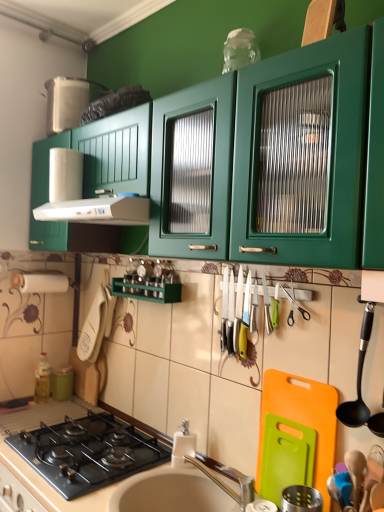
Question: Could you tell me if silver metallic faucet at sink center is turned towards white plastic exhaust hood at upper left?

Choices:
 (A) yes
 (B) no

Answer: (B)

Question: From the image's perspective, does silver metallic faucet at sink center appear lower than white plastic exhaust hood at upper left?

Choices:
 (A) yes
 (B) no

Answer: (A)

Question: From a real-world perspective, is silver metallic faucet at sink center positioned over white plastic exhaust hood at upper left based on gravity?

Choices:
 (A) yes
 (B) no

Answer: (B)

Question: Is silver metallic faucet at sink center in front of white plastic exhaust hood at upper left?

Choices:
 (A) yes
 (B) no

Answer: (A)

Question: Considering the relative sizes of silver metallic faucet at sink center and white plastic exhaust hood at upper left in the image provided, is silver metallic faucet at sink center smaller than white plastic exhaust hood at upper left?

Choices:
 (A) yes
 (B) no

Answer: (A)

Question: Is wooden spoon at lower right, marked as the 2th utensil in a top-to-bottom arrangement, in front of or behind blue rubber spatula at lower right, the 1th appliance when ordered from right to left, in the image?

Choices:
 (A) behind
 (B) front

Answer: (B)

Question: Would you say wooden spoon at lower right, marked as the 2th utensil in a top-to-bottom arrangement, is inside or outside blue rubber spatula at lower right, marked as the third appliance in a back-to-front arrangement?

Choices:
 (A) outside
 (B) inside

Answer: (B)

Question: Is wooden spoon at lower right, the first utensil from the bottom, wider or thinner than blue rubber spatula at lower right, the 1th appliance when ordered from right to left?

Choices:
 (A) thin
 (B) wide

Answer: (B)

Question: Considering the relative positions of wooden spoon at lower right, the first utensil from the bottom, and blue rubber spatula at lower right, marked as the third appliance in a back-to-front arrangement, in the image provided, is wooden spoon at lower right, the first utensil from the bottom, to the left or to the right of blue rubber spatula at lower right, marked as the third appliance in a back-to-front arrangement,?

Choices:
 (A) right
 (B) left

Answer: (B)

Question: From a real-world perspective, is white glossy sink at lower center physically located above or below green plastic cutting board at lower right, the 2th appliance positioned from the back?

Choices:
 (A) below
 (B) above

Answer: (A)

Question: In terms of width, does white glossy sink at lower center look wider or thinner when compared to green plastic cutting board at lower right, the 2th appliance from the left?

Choices:
 (A) wide
 (B) thin

Answer: (A)

Question: From their relative heights in the image, would you say white glossy sink at lower center is taller or shorter than green plastic cutting board at lower right, acting as the second appliance starting from the right?

Choices:
 (A) tall
 (B) short

Answer: (B)

Question: Looking at the image, does white glossy sink at lower center seem bigger or smaller compared to green plastic cutting board at lower right, acting as the second appliance starting from the right?

Choices:
 (A) small
 (B) big

Answer: (B)

Question: Looking at the image, does black glass gas stove at lower left seem bigger or smaller compared to green matte canister at lower left, which is the first appliance in back-to-front order?

Choices:
 (A) small
 (B) big

Answer: (B)

Question: In terms of width, does black glass gas stove at lower left look wider or thinner when compared to green matte canister at lower left, which is the first appliance in back-to-front order?

Choices:
 (A) wide
 (B) thin

Answer: (A)